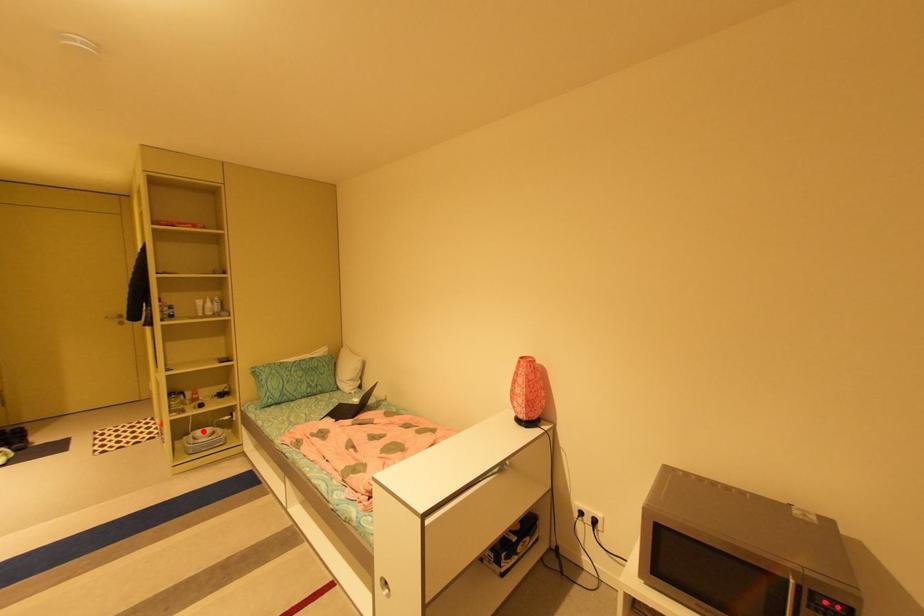
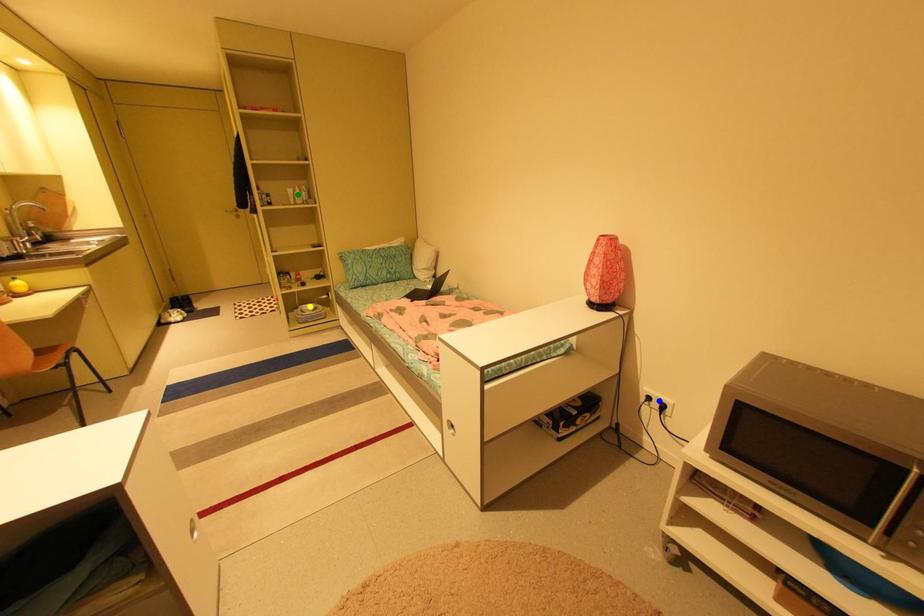
Question: I am providing you with two images of the same scene from different viewpoints. A red point is marked on the first image. You are given multiple points on the second image. Which point in image 2 is actually the same real-world point as the red point in image 1?

Choices:
 (A) blue point
 (B) yellow point
 (C) green point

Answer: (B)